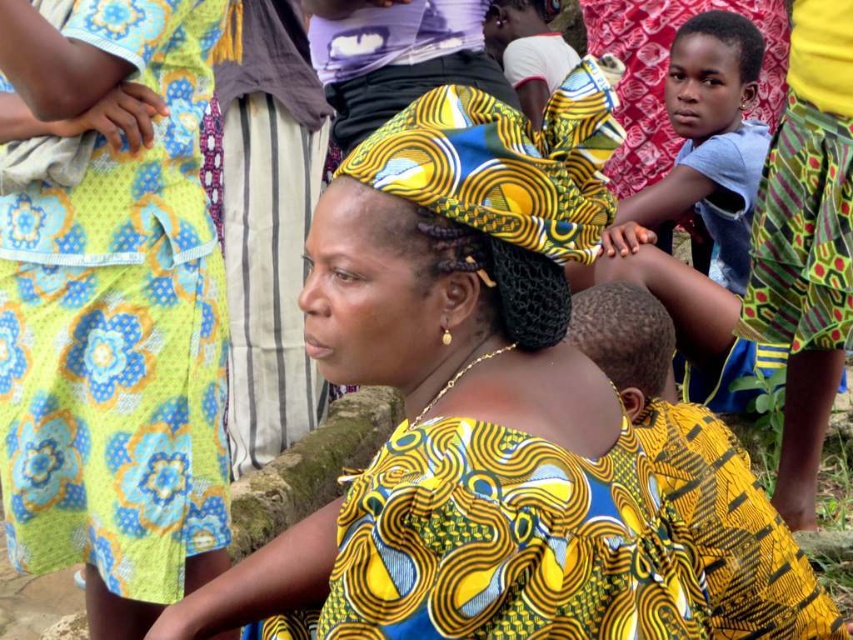
Who is lower down, yellow printed fabric dress at left or dark brown skin at upper right?

yellow printed fabric dress at left is lower down.

Between yellow printed fabric dress at left and dark brown skin at upper right, which one has more height?

yellow printed fabric dress at left

Which is in front, point (195, 330) or point (676, 90)?

Point (195, 330)

Find the location of a particular element. The image size is (853, 640). yellow printed fabric dress at left is located at coordinates (119, 332).

The image size is (853, 640). What do you see at coordinates (711, 74) in the screenshot?
I see `dark brown skin at upper right` at bounding box center [711, 74].

Is dark brown skin at upper right positioned before dark brown hair at center?

No, it is not.

Which is in front, point (746, 83) or point (590, 316)?

Point (590, 316) is in front.

This screenshot has height=640, width=853. What are the coordinates of `dark brown skin at upper right` in the screenshot? It's located at (711, 74).

Which is more to the left, yellow printed fabric at center or dark brown skin at upper right?

Positioned to the left is yellow printed fabric at center.

Can you confirm if yellow printed fabric at center is wider than dark brown skin at upper right?

Indeed, yellow printed fabric at center has a greater width compared to dark brown skin at upper right.

The image size is (853, 640). I want to click on yellow printed fabric at center, so click(x=468, y=401).